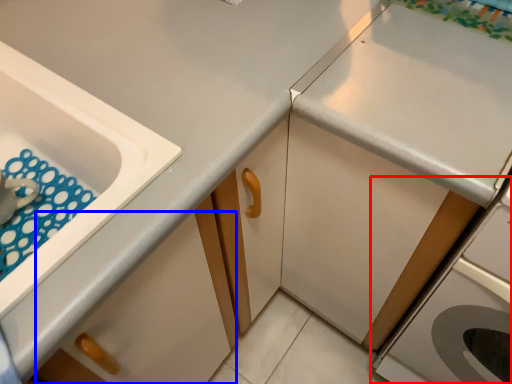
Question: Among these objects, which one is farthest to the camera, home appliance (highlighted by a red box) or drawer (highlighted by a blue box)?

Choices:
 (A) home appliance
 (B) drawer

Answer: (A)